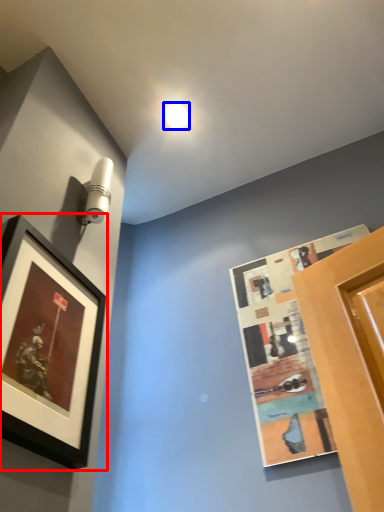
Question: Which object is further to the camera taking this photo, picture frame (highlighted by a red box) or droplight (highlighted by a blue box)?

Choices:
 (A) picture frame
 (B) droplight

Answer: (B)